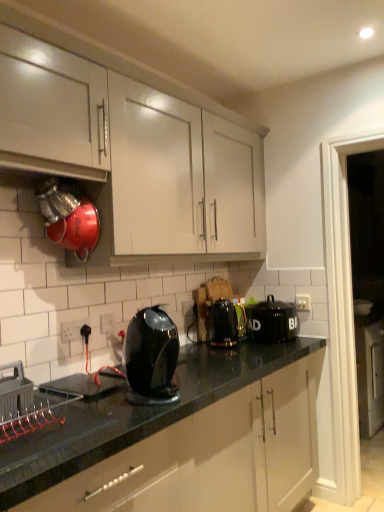
Question: Is metallic gray crate at lower left wider than white plastic electric outlet at lower left, which ranks as the third electric outlet in right-to-left order?

Choices:
 (A) yes
 (B) no

Answer: (A)

Question: Is metallic gray crate at lower left behind white plastic electric outlet at lower left, which ranks as the third electric outlet in right-to-left order?

Choices:
 (A) yes
 (B) no

Answer: (B)

Question: Is metallic gray crate at lower left at the right side of white plastic electric outlet at lower left, which is counted as the third electric outlet, starting from the back?

Choices:
 (A) yes
 (B) no

Answer: (B)

Question: Is there a large distance between metallic gray crate at lower left and white plastic electric outlet at lower left, the 1th electric outlet viewed from the front?

Choices:
 (A) no
 (B) yes

Answer: (A)

Question: Does metallic gray crate at lower left appear on the left side of white plastic electric outlet at lower left, which is counted as the third electric outlet, starting from the back?

Choices:
 (A) yes
 (B) no

Answer: (A)

Question: From the image's perspective, does metallic gray crate at lower left appear higher than white plastic electric outlet at lower left, the 1th electric outlet viewed from the front?

Choices:
 (A) yes
 (B) no

Answer: (B)

Question: Is white plastic electric outlet at lower left, the 1th electric outlet when ordered from left to right, wider than white plastic electric outlet at center, placed as the 1th electric outlet when sorted from right to left?

Choices:
 (A) no
 (B) yes

Answer: (B)

Question: Is white plastic electric outlet at center, the first electric outlet viewed from the back, at the back of white plastic electric outlet at lower left, the 1th electric outlet when ordered from left to right?

Choices:
 (A) no
 (B) yes

Answer: (A)

Question: Can you confirm if white plastic electric outlet at lower left, which is counted as the third electric outlet, starting from the back, is shorter than white plastic electric outlet at center, the 3th electric outlet from the front?

Choices:
 (A) no
 (B) yes

Answer: (A)

Question: Is white plastic electric outlet at lower left, which ranks as the third electric outlet in right-to-left order, closer to camera compared to white plastic electric outlet at center, the 3th electric outlet from the front?

Choices:
 (A) yes
 (B) no

Answer: (A)

Question: Is white plastic electric outlet at lower left, which is counted as the third electric outlet, starting from the back, not near white plastic electric outlet at center, the 3th electric outlet positioned from the left?

Choices:
 (A) yes
 (B) no

Answer: (B)

Question: Is white plastic electric outlet at lower left, which is counted as the third electric outlet, starting from the back, smaller than white plastic electric outlet at center, the first electric outlet viewed from the back?

Choices:
 (A) no
 (B) yes

Answer: (A)

Question: Is white matte cabinet at upper left at the back of metallic gray crate at lower left?

Choices:
 (A) yes
 (B) no

Answer: (B)